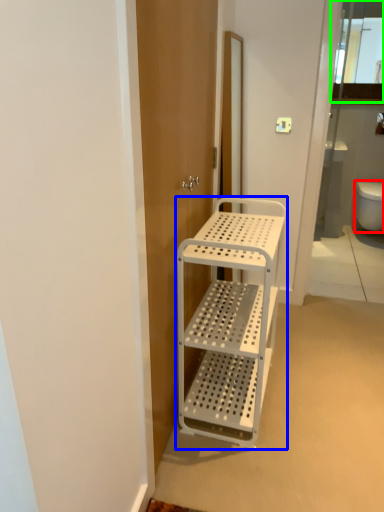
Question: Estimate the real-world distances between objects in this image. Which object is closer to toilet bowl (highlighted by a red box), furniture (highlighted by a blue box) or cabinet (highlighted by a green box)?

Choices:
 (A) furniture
 (B) cabinet

Answer: (B)